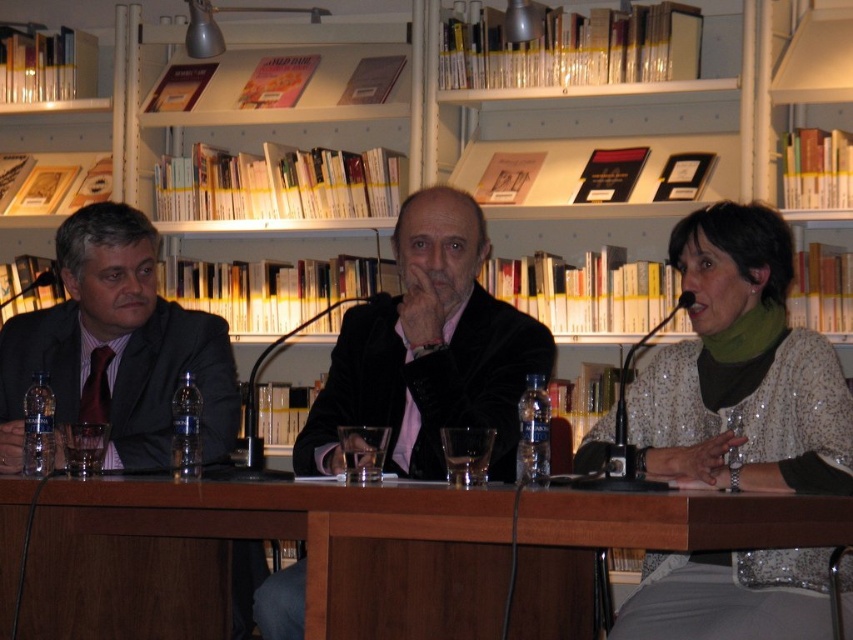
Question: From the image, what is the correct spatial relationship of wooden table at center in relation to matte black suit at left?

Choices:
 (A) below
 (B) above

Answer: (A)

Question: Does velvet black jacket at center appear on the left side of matte black suit at left?

Choices:
 (A) yes
 (B) no

Answer: (B)

Question: Does wooden table at center appear over matte black suit at left?

Choices:
 (A) no
 (B) yes

Answer: (A)

Question: Which point is farther to the camera?

Choices:
 (A) wooden table at center
 (B) sparkly silver blouse at center

Answer: (B)

Question: Based on their relative distances, which object is farther from the velvet black jacket at center?

Choices:
 (A) matte black suit at left
 (B) sparkly silver blouse at center

Answer: (A)

Question: Among these objects, which one is nearest to the camera?

Choices:
 (A) sparkly silver blouse at center
 (B) wooden table at center
 (C) velvet black jacket at center

Answer: (B)